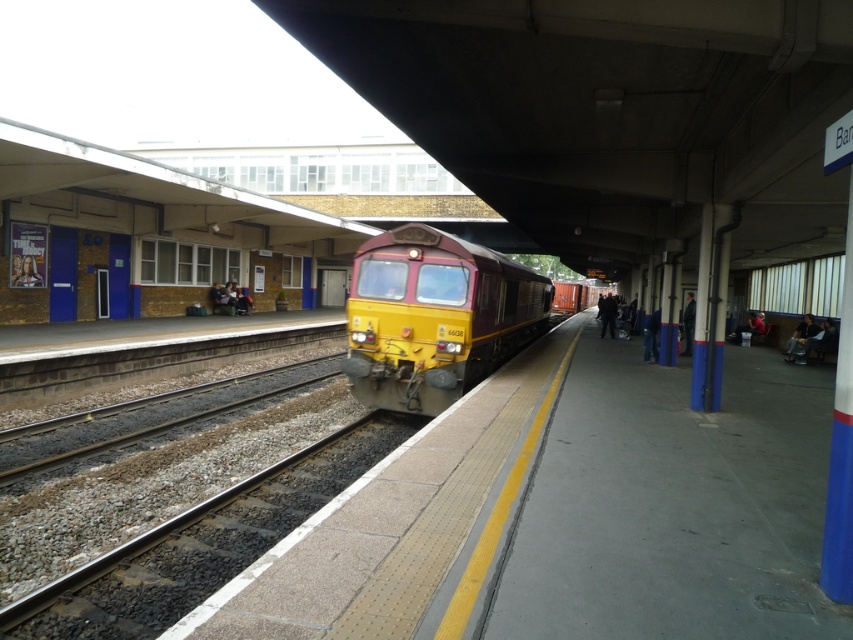
Between yellow polished metal train at center and brown gravel track at center, which one appears on the right side from the viewer's perspective?

yellow polished metal train at center is more to the right.

How much distance is there between yellow polished metal train at center and brown gravel track at center?

yellow polished metal train at center is 7.33 meters away from brown gravel track at center.

Locate an element on the screen. The width and height of the screenshot is (853, 640). yellow polished metal train at center is located at coordinates (434, 316).

Is gravel railway track at center shorter than yellow polished metal train at center?

Correct, gravel railway track at center is not as tall as yellow polished metal train at center.

Does gravel railway track at center have a lesser width compared to yellow polished metal train at center?

Yes, gravel railway track at center is thinner than yellow polished metal train at center.

Is point (170, 588) more distant than point (448, 257)?

That is False.

Locate an element on the screen. Image resolution: width=853 pixels, height=640 pixels. gravel railway track at center is located at coordinates (196, 547).

Is gravel railway track at center shorter than brown gravel track at center?

Correct, gravel railway track at center is not as tall as brown gravel track at center.

Who is more forward, (30, 625) or (207, 385)?

Result: Point (30, 625)

Between point (160, 547) and point (210, 385), which one is positioned in front?

Point (160, 547) is more forward.

The image size is (853, 640). I want to click on gravel railway track at center, so click(x=196, y=547).